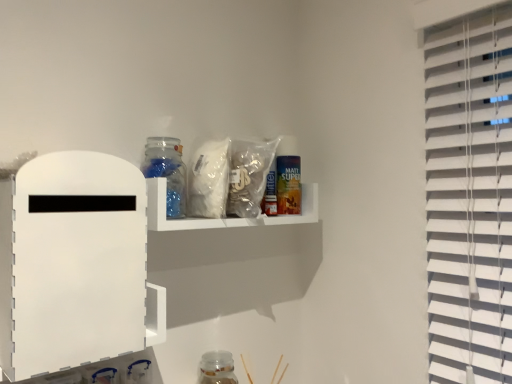
Question: From the image's perspective, relative to translucent plastic shelf at upper center, which is the first shelf from right to left, is transparent glass jar at lower center, which is the 1th bottle from bottom to top, above or below?

Choices:
 (A) below
 (B) above

Answer: (A)

Question: Considering the positions of transparent glass jar at lower center, the second bottle viewed from the top, and translucent plastic shelf at upper center, the 1th shelf when ordered from back to front, in the image, is transparent glass jar at lower center, the second bottle viewed from the top, wider or thinner than translucent plastic shelf at upper center, the 1th shelf when ordered from back to front,?

Choices:
 (A) wide
 (B) thin

Answer: (B)

Question: Based on their relative distances, which object is nearer to the translucent plastic shelf at upper center, the 1th shelf when ordered from back to front?

Choices:
 (A) translucent plastic bag at upper center
 (B) transparent glass jar at upper center, the 1th bottle viewed from the front
 (C) white matte board at left, placed as the first shelf when sorted from front to back
 (D) transparent glass jar at lower center, which is the 1th bottle from bottom to top

Answer: (A)

Question: Which object is the closest to the translucent plastic bag at upper center?

Choices:
 (A) transparent glass jar at lower center, the 2th bottle in the front-to-back sequence
 (B) translucent plastic shelf at upper center, which is the first shelf from right to left
 (C) white matte board at left, which is the 2th shelf in back-to-front order
 (D) transparent glass jar at upper center, which ranks as the second bottle in right-to-left order

Answer: (B)